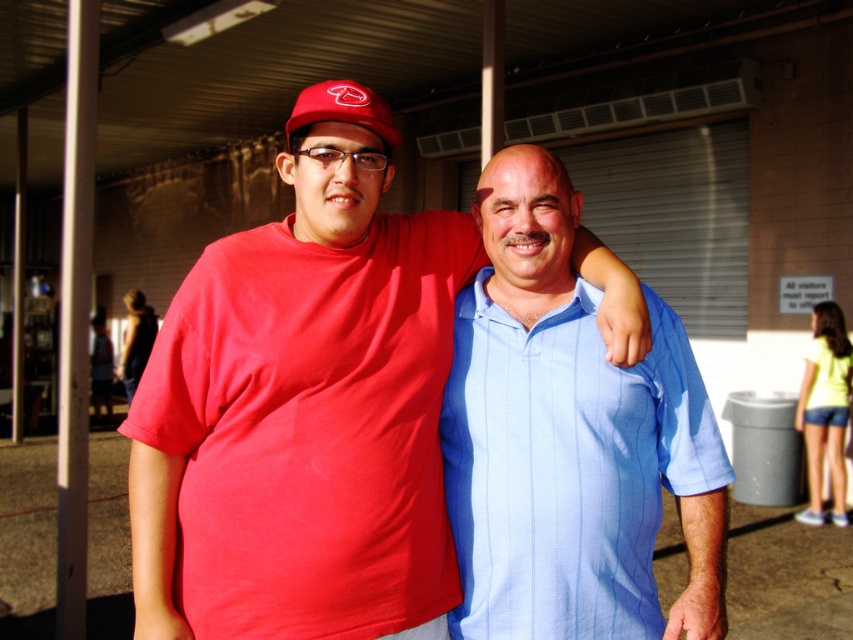
You are standing at the point marked by the coordinates point (302,417) in the image. Looking around, you see a matte red shirt at center. Which direction should you move to get closer to the person wearing the light blue, short sleeved collared shirt?

The person wearing the light blue, short sleeved collared shirt is to the right of the matte red shirt at center. Move to the right to get closer to them.

You are a photographer at the fairground and want to capture both the matte red shirt at center and the matte red baseball cap at upper center in a single frame. Which object should you focus on first to ensure both are in the frame?

You should focus on the matte red baseball cap at upper center first because the matte red shirt at center is located below it, so starting at the top ensures both are included in the frame.